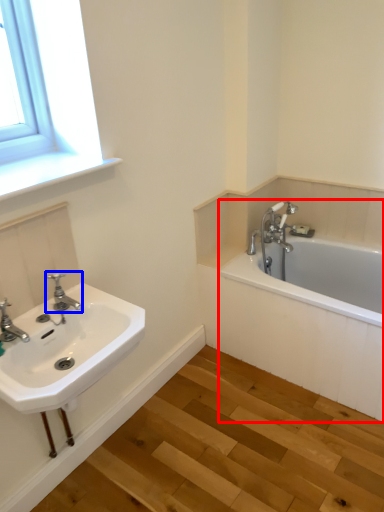
Question: Which object appears closest to the camera in this image, bathtub (highlighted by a red box) or tap (highlighted by a blue box)?

Choices:
 (A) bathtub
 (B) tap

Answer: (B)